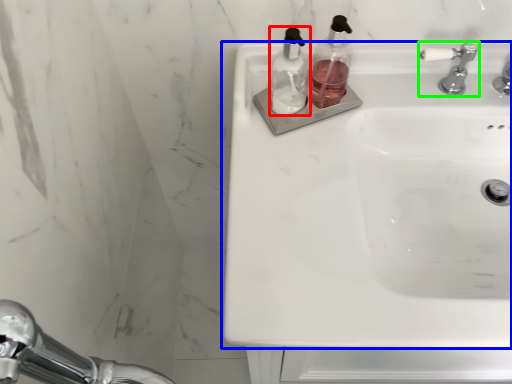
Question: Which object is positioned closest to soap dispenser (highlighted by a red box)? Select from sink (highlighted by a blue box) and tap (highlighted by a green box).

Choices:
 (A) sink
 (B) tap

Answer: (A)